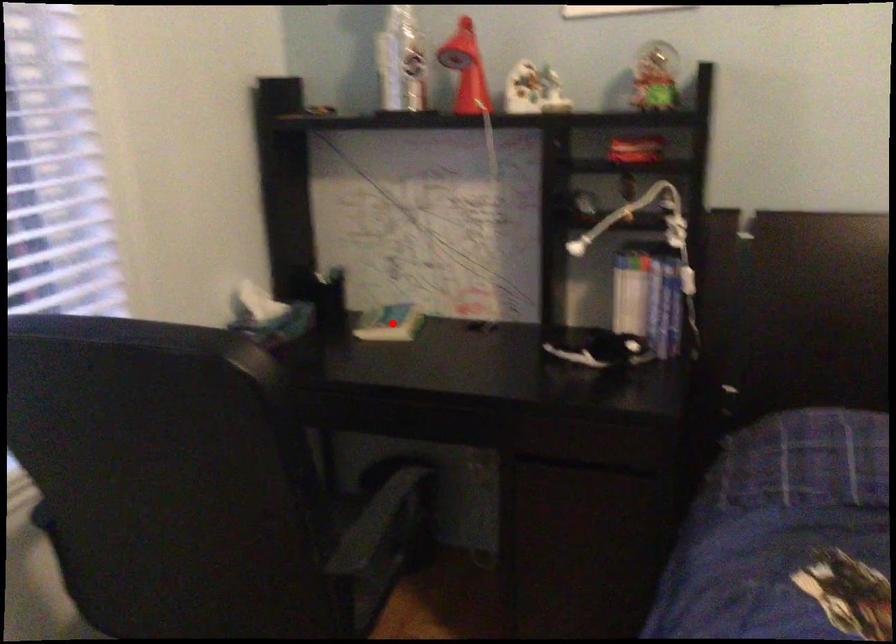
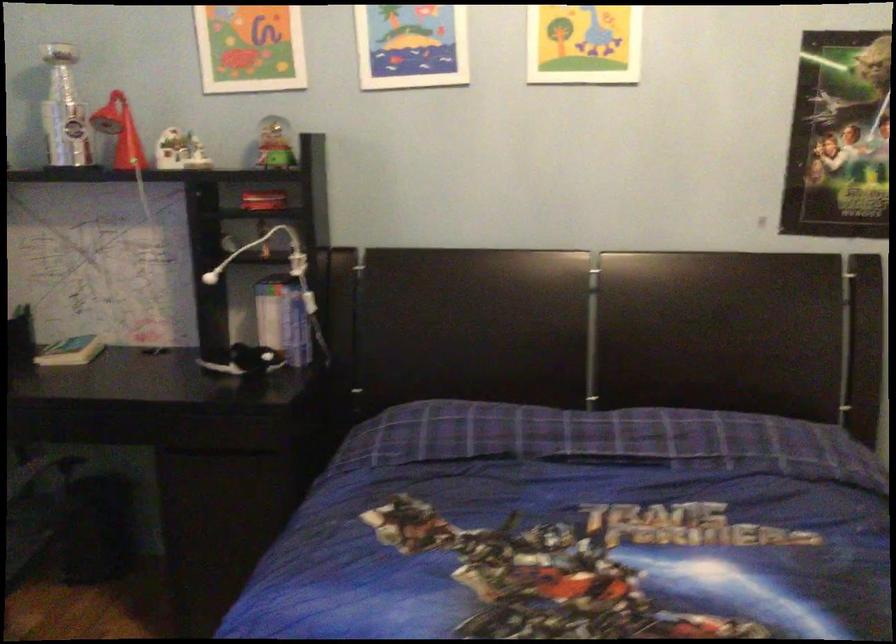
The point at the highlighted location is marked in the first image. Where is the corresponding point in the second image?

(71, 351)